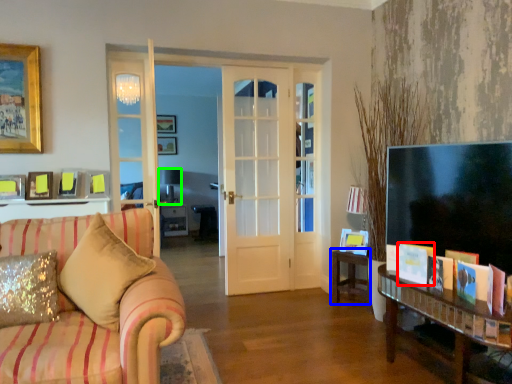
Question: Which object is positioned closest to book (highlighted by a red box)? Select from table (highlighted by a blue box) and lamp (highlighted by a green box).

Choices:
 (A) table
 (B) lamp

Answer: (A)